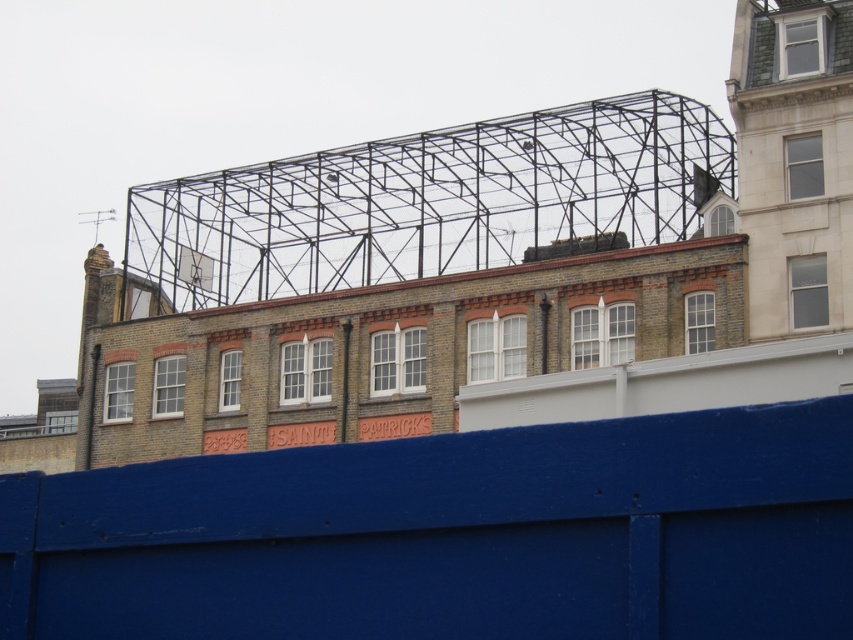
From the picture: You are an architect examining the building facade. You notice the blue painted wood at center and the black metal scaffolding at upper center. Which object would require a larger storage space when packing them separately?

The black metal scaffolding at upper center requires a larger storage space because it is bigger in size compared to the blue painted wood at center.

You are an architect inspecting the building from the street. You notice the blue painted wood at center and the black metal scaffolding at upper center. Which object is closer to you?

The blue painted wood at center is closer to you because it is in front of the black metal scaffolding at upper center.